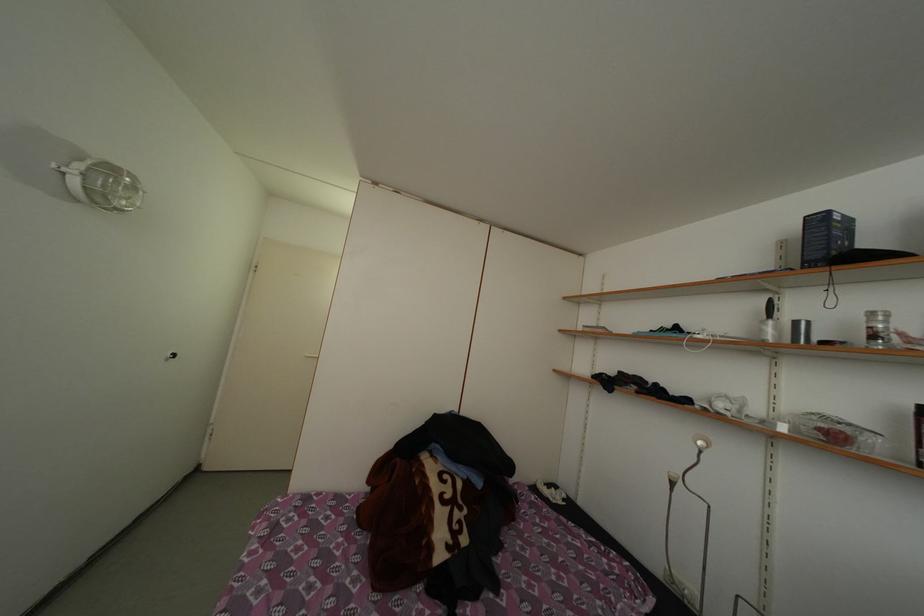
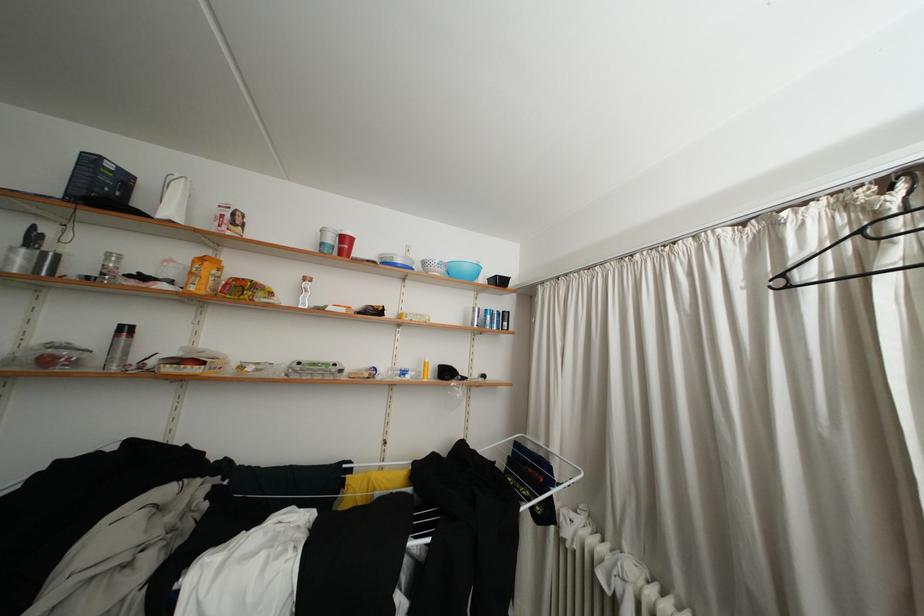
Locate, in the second image, the point that corresponds to (769,336) in the first image.

(17, 264)